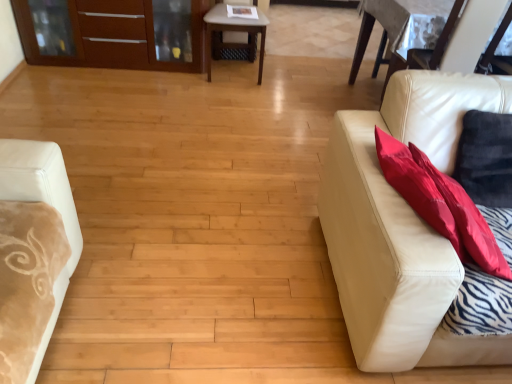
Question: Based on their positions, is light brown wooden table at center located to the left or right of leather couch at right?

Choices:
 (A) right
 (B) left

Answer: (B)

Question: In the image, is light brown wooden table at center positioned in front of or behind leather couch at right?

Choices:
 (A) behind
 (B) front

Answer: (A)

Question: Which object is positioned farthest from the matte wood dresser at upper left?

Choices:
 (A) light brown wooden table at center
 (B) red fabric pillow at right
 (C) leather couch at right

Answer: (B)

Question: Estimate the real-world distances between objects in this image. Which object is closer to the light brown wooden table at center?

Choices:
 (A) leather couch at right
 (B) matte wood dresser at upper left
 (C) red fabric pillow at right

Answer: (B)